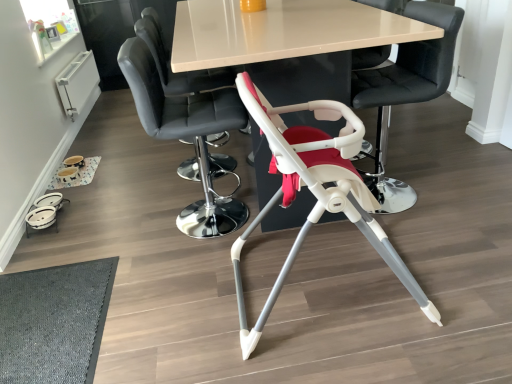
Question: In which direction should I rotate to look at smooth black chair at center, which is the 3th chair in right-to-left order?

Choices:
 (A) right
 (B) left

Answer: (B)

Question: From a real-world perspective, is white plastic highchair at center, placed as the second chair when sorted from right to left, over dark gray textured mat at lower left?

Choices:
 (A) no
 (B) yes

Answer: (B)

Question: Considering the relative sizes of white plastic highchair at center, which appears as the 3th chair when viewed from the left, and dark gray textured mat at lower left in the image provided, is white plastic highchair at center, which appears as the 3th chair when viewed from the left, taller than dark gray textured mat at lower left?

Choices:
 (A) no
 (B) yes

Answer: (B)

Question: Can you confirm if white plastic highchair at center, placed as the second chair when sorted from right to left, is positioned to the left of dark gray textured mat at lower left?

Choices:
 (A) no
 (B) yes

Answer: (A)

Question: Can you confirm if white plastic highchair at center, which appears as the 3th chair when viewed from the left, is bigger than dark gray textured mat at lower left?

Choices:
 (A) no
 (B) yes

Answer: (B)

Question: From the image's perspective, is white plastic highchair at center, which appears as the 3th chair when viewed from the left, located above dark gray textured mat at lower left?

Choices:
 (A) yes
 (B) no

Answer: (A)

Question: From a real-world perspective, is white plastic highchair at center, placed as the second chair when sorted from right to left, physically below dark gray textured mat at lower left?

Choices:
 (A) yes
 (B) no

Answer: (B)

Question: Is smooth leather chair at upper center, the fourth chair when ordered from right to left, at the right side of white plastic highchair at center, which appears as the 3th chair when viewed from the left?

Choices:
 (A) yes
 (B) no

Answer: (B)

Question: Is smooth leather chair at upper center, which is the first chair in left-to-right order, further to the viewer compared to white plastic highchair at center, which appears as the 3th chair when viewed from the left?

Choices:
 (A) yes
 (B) no

Answer: (A)

Question: Can you confirm if smooth leather chair at upper center, the fourth chair when ordered from right to left, is bigger than white plastic highchair at center, which appears as the 3th chair when viewed from the left?

Choices:
 (A) yes
 (B) no

Answer: (B)

Question: Considering the relative sizes of smooth leather chair at upper center, which is the first chair in left-to-right order, and white plastic highchair at center, placed as the second chair when sorted from right to left, in the image provided, is smooth leather chair at upper center, which is the first chair in left-to-right order, thinner than white plastic highchair at center, placed as the second chair when sorted from right to left,?

Choices:
 (A) no
 (B) yes

Answer: (B)

Question: Is smooth leather chair at upper center, the fourth chair when ordered from right to left, taller than white plastic highchair at center, placed as the second chair when sorted from right to left?

Choices:
 (A) no
 (B) yes

Answer: (B)

Question: Can you confirm if smooth leather chair at upper center, which is the first chair in left-to-right order, is wider than white plastic highchair at center, placed as the second chair when sorted from right to left?

Choices:
 (A) no
 (B) yes

Answer: (A)

Question: From a real-world perspective, is smooth leather chair at upper center, which is the first chair in left-to-right order, positioned under smooth black chair at center, the second chair when ordered from left to right, based on gravity?

Choices:
 (A) no
 (B) yes

Answer: (A)